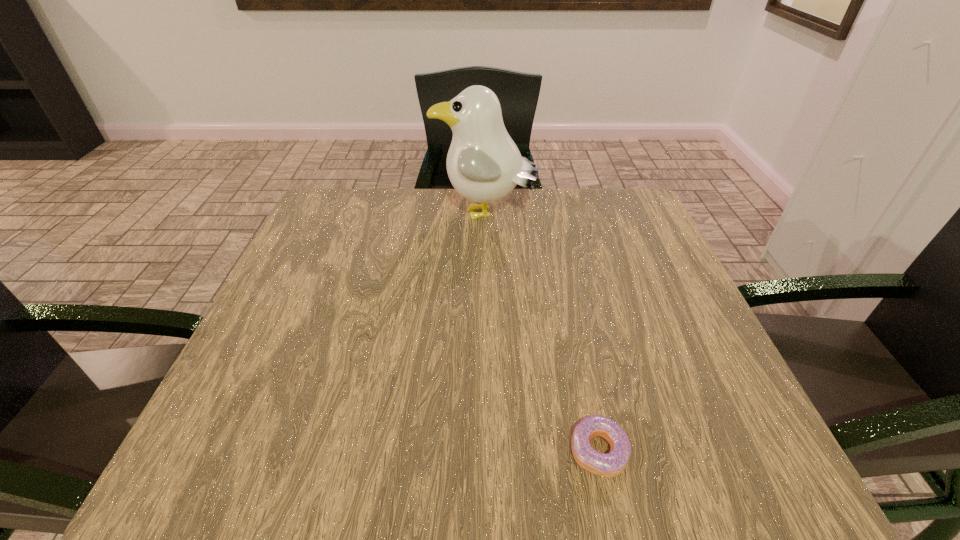
Find the location of a particular element. vacant space that satisfies the following two spatial constraints: 1. on the beak of the farther object; 2. on the right side of the nearer object is located at coordinates (489, 451).

Identify the location of vacant space that satisfies the following two spatial constraints: 1. on the beak of the gull; 2. on the back side of the shorter object. This screenshot has width=960, height=540. (489, 451).

You are a GUI agent. You are given a task and a screenshot of the screen. Output one action in this format:
    pyautogui.click(x=<x>, y=<y>)
    Task: Click on the vacant area that satisfies the following two spatial constraints: 1. on the beak of the shorter object; 2. on the right side of the taller object
    The width and height of the screenshot is (960, 540).
    Given the screenshot: What is the action you would take?
    click(489, 451)